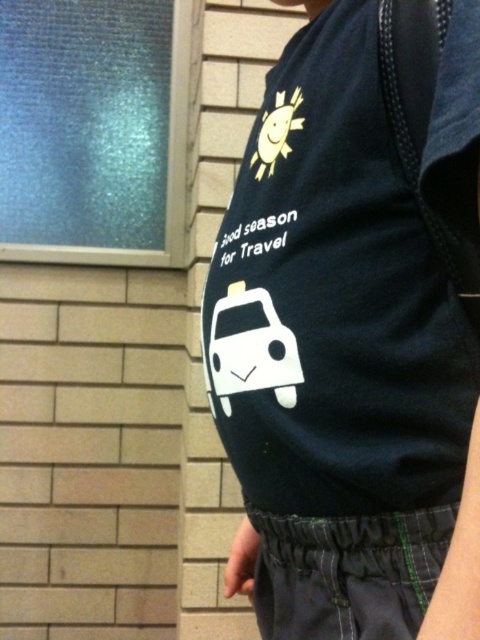
Does navy blue cotton t-shirt at center have a lesser width compared to dark blue fabric pocket at lower center?

No, navy blue cotton t-shirt at center is not thinner than dark blue fabric pocket at lower center.

Between point (468, 61) and point (367, 614), which one is positioned in front?

Positioned in front is point (468, 61).

Does point (442, 209) come behind point (428, 541)?

That is False.

At what (x,y) coordinates should I click in order to perform the action: click on navy blue cotton t-shirt at center. Please return your answer as a coordinate pair (x, y). Looking at the image, I should click on (351, 273).